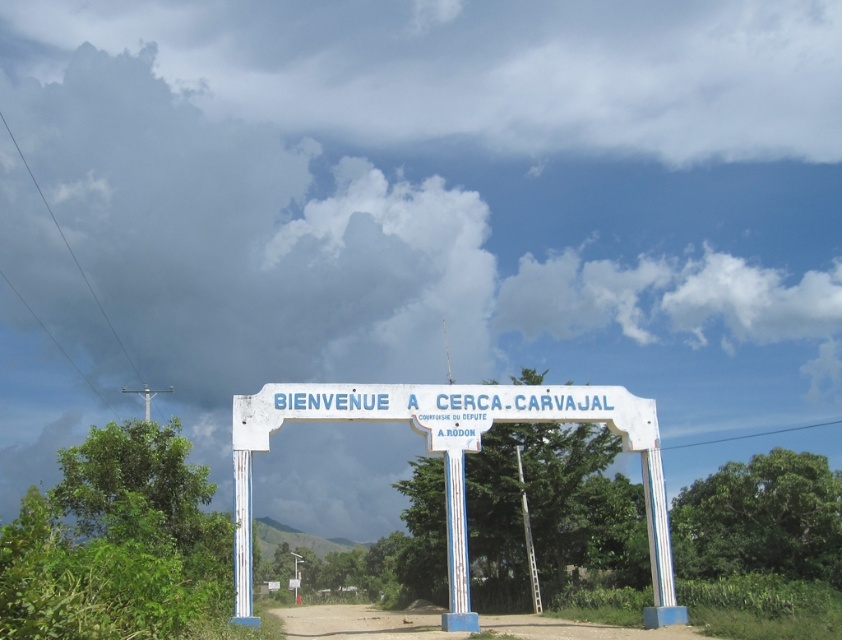
Question: Does white painted metal arch at center appear on the left side of brown dirt track at lower center?

Choices:
 (A) no
 (B) yes

Answer: (A)

Question: Which point is closer to the camera taking this photo?

Choices:
 (A) [x=635, y=424]
 (B) [x=531, y=636]

Answer: (B)

Question: Is white painted metal arch at center closer to camera compared to brown dirt track at lower center?

Choices:
 (A) no
 (B) yes

Answer: (B)

Question: Can you confirm if white painted metal arch at center is smaller than brown dirt track at lower center?

Choices:
 (A) yes
 (B) no

Answer: (A)